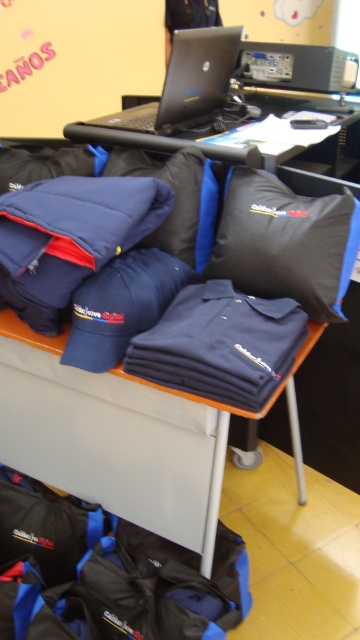
Question: Can you confirm if black fabric bag at lower left is bigger than black matte laptop at upper center?

Choices:
 (A) no
 (B) yes

Answer: (A)

Question: Among these objects, which one is nearest to the camera?

Choices:
 (A) navy blue fabric shirt at center
 (B) black fabric bag at lower left
 (C) black glossy laptop at upper center

Answer: (A)

Question: Does black matte laptop at upper center have a larger size compared to black glossy laptop at upper center?

Choices:
 (A) no
 (B) yes

Answer: (B)

Question: Which point appears farthest from the camera in this image?

Choices:
 (A) (169, 460)
 (B) (209, 113)
 (C) (101, 625)

Answer: (B)

Question: Does black fabric bag at lower left appear on the left side of black glossy laptop at upper center?

Choices:
 (A) no
 (B) yes

Answer: (B)

Question: Based on their relative distances, which object is farther from the black fabric bag at lower left?

Choices:
 (A) navy blue fabric shirt at center
 (B) black glossy laptop at upper center
 (C) black matte laptop at upper center

Answer: (B)